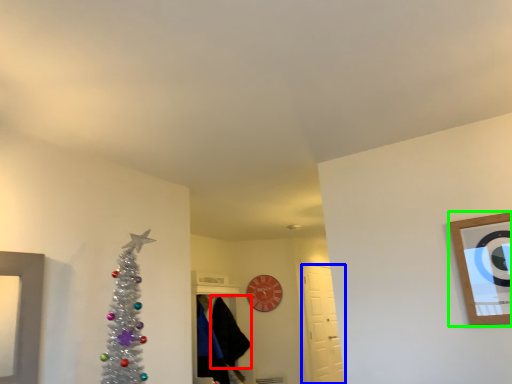
Question: Which object is the farthest from robe (highlighted by a red box)? Choose among these: door (highlighted by a blue box) or picture frame (highlighted by a green box).

Choices:
 (A) door
 (B) picture frame

Answer: (B)